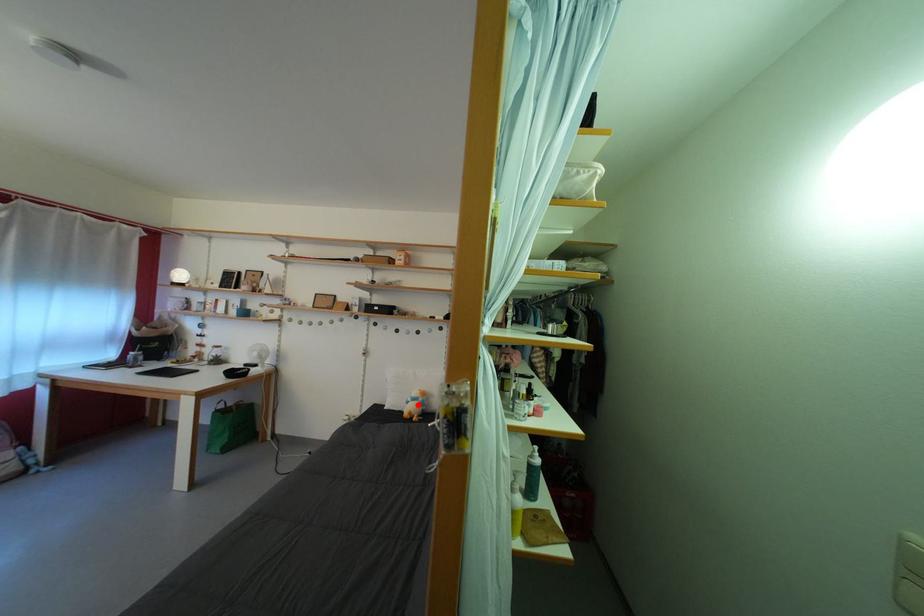
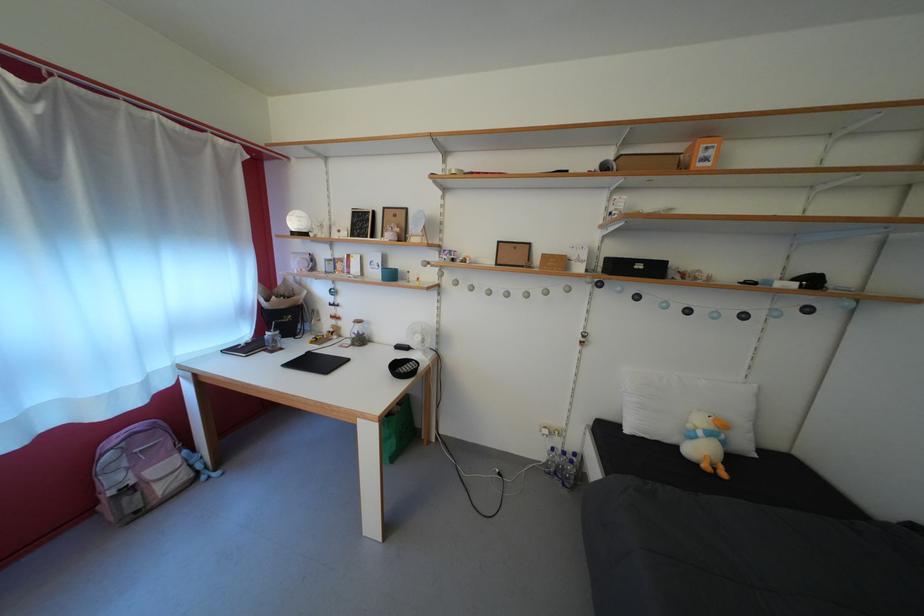
Where in the second image is the point corresponding to the highlighted location from the first image?

(709, 439)